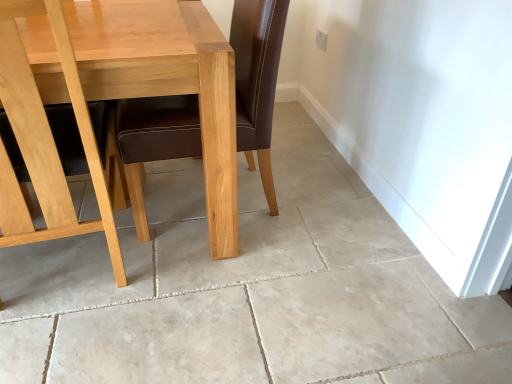
Where is `light brown wood table at center`? The image size is (512, 384). light brown wood table at center is located at coordinates (167, 81).

Where is `beige tile floor at center`? beige tile floor at center is located at coordinates (249, 289).

Where is `light brown wood table at center`? The image size is (512, 384). light brown wood table at center is located at coordinates (167, 81).

In the scene shown: Can you confirm if light brown wood chair at left is thinner than beige tile floor at center?

Correct, the width of light brown wood chair at left is less than that of beige tile floor at center.

Does light brown wood chair at left have a greater height compared to beige tile floor at center?

Yes, light brown wood chair at left is taller than beige tile floor at center.

Where is `concrete directly beneath the light brown wood chair at left (from a real-world perspective)`? concrete directly beneath the light brown wood chair at left (from a real-world perspective) is located at coordinates (249, 289).

Is beige tile floor at center far from light brown wood table at center?

beige tile floor at center is near light brown wood table at center, not far away.

Which object is wider, beige tile floor at center or light brown wood table at center?

beige tile floor at center is wider.

Consider the image. From a real-world perspective, is beige tile floor at center located higher than light brown wood table at center?

No, from a real-world perspective, beige tile floor at center is not over light brown wood table at center

Who is smaller, beige tile floor at center or light brown wood table at center?

With smaller size is beige tile floor at center.

Does light brown wood table at center appear on the left side of light brown wood chair at left?

No, light brown wood table at center is not to the left of light brown wood chair at left.

How many degrees apart are the facing directions of light brown wood table at center and light brown wood chair at left?

The angle between the facing direction of light brown wood table at center and the facing direction of light brown wood chair at left is 180 degrees.

Is light brown wood table at center turned away from light brown wood chair at left?

Yes, light brown wood table at center is facing away from light brown wood chair at left.

Measure the distance between light brown wood table at center and light brown wood chair at left.

light brown wood table at center is 9.13 inches away from light brown wood chair at left.

Can you tell me how much beige tile floor at center and light brown wood chair at left differ in facing direction?

179 degrees.

From a real-world perspective, is beige tile floor at center above or below light brown wood chair at left?

beige tile floor at center is below light brown wood chair at left.

Is there a large distance between beige tile floor at center and light brown wood chair at left?

They are positioned close to each other.

From a real-world perspective, is light brown wood table at center positioned over beige tile floor at center based on gravity?

Yes.

Is light brown wood table at center positioned with its back to beige tile floor at center?

No, beige tile floor at center is not at the back of light brown wood table at center.

From the picture: Which point is more distant from viewer, (131, 30) or (191, 196)?

The point (191, 196) is behind.

How far apart are light brown wood chair at left and light brown wood table at center?

light brown wood chair at left is 23.18 centimeters away from light brown wood table at center.

Is light brown wood chair at left at the left side of light brown wood table at center?

Indeed, light brown wood chair at left is positioned on the left side of light brown wood table at center.

In the image, is light brown wood chair at left positioned in front of or behind light brown wood table at center?

Clearly, light brown wood chair at left is in front of light brown wood table at center.

Is light brown wood chair at left beside light brown wood table at center?

light brown wood chair at left and light brown wood table at center are not in contact.

At what (x,y) coordinates should I click in order to perform the action: click on concrete on the right of light brown wood chair at left. Please return your answer as a coordinate pair (x, y). This screenshot has height=384, width=512. Looking at the image, I should click on (249, 289).

You are a GUI agent. You are given a task and a screenshot of the screen. Output one action in this format:
    pyautogui.click(x=<x>, y=<y>)
    Task: Click on the table above the beige tile floor at center (from the image's perspective)
    The height and width of the screenshot is (384, 512).
    Given the screenshot: What is the action you would take?
    pyautogui.click(x=167, y=81)

Looking at the image, which one is located further to light brown wood chair at left, light brown wood table at center or beige tile floor at center?

Based on the image, beige tile floor at center appears to be further to light brown wood chair at left.

Considering their positions, is beige tile floor at center positioned closer to light brown wood table at center than light brown wood chair at left?

Among the two, light brown wood chair at left is located nearer to light brown wood table at center.

Estimate the real-world distances between objects in this image. Which object is closer to beige tile floor at center, light brown wood table at center or light brown wood chair at left?

light brown wood chair at left lies closer to beige tile floor at center than the other object.

Considering their positions, is light brown wood chair at left positioned closer to light brown wood table at center than beige tile floor at center?

light brown wood chair at left is closer to light brown wood table at center.

From the image, which object appears to be farther from light brown wood chair at left, beige tile floor at center or light brown wood table at center?

beige tile floor at center lies further to light brown wood chair at left than the other object.

Looking at the image, which one is located further to beige tile floor at center, light brown wood chair at left or light brown wood table at center?

light brown wood table at center is positioned further to the anchor beige tile floor at center.

The image size is (512, 384). In order to click on table situated between light brown wood chair at left and beige tile floor at center from left to right in this screenshot , I will do `click(167, 81)`.